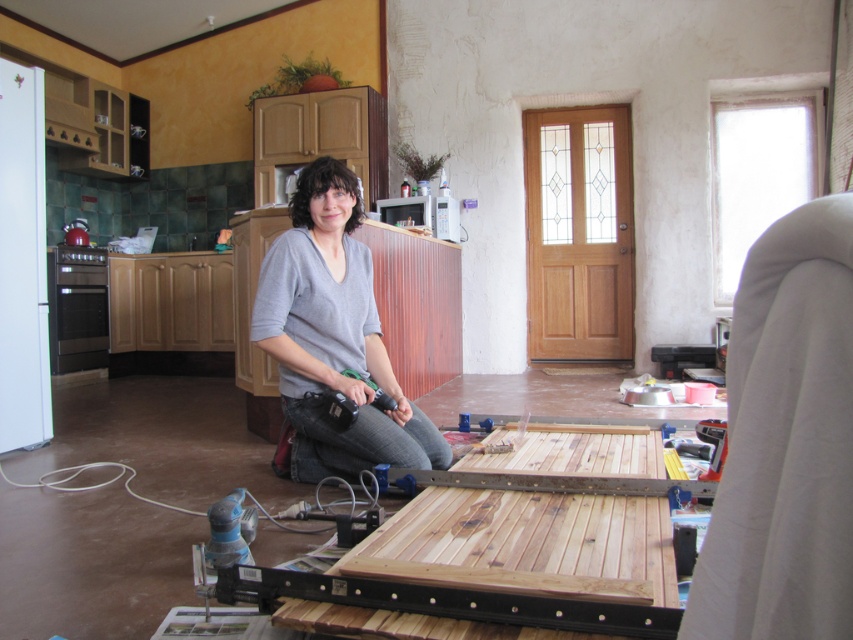
Can you confirm if white fabric armchair at right is thinner than gray cotton shirt at center?

Indeed, white fabric armchair at right has a lesser width compared to gray cotton shirt at center.

Between white fabric armchair at right and gray cotton shirt at center, which one is positioned higher?

gray cotton shirt at center

The width and height of the screenshot is (853, 640). I want to click on white fabric armchair at right, so click(x=785, y=442).

Where is `white fabric armchair at right`? white fabric armchair at right is located at coordinates (785, 442).